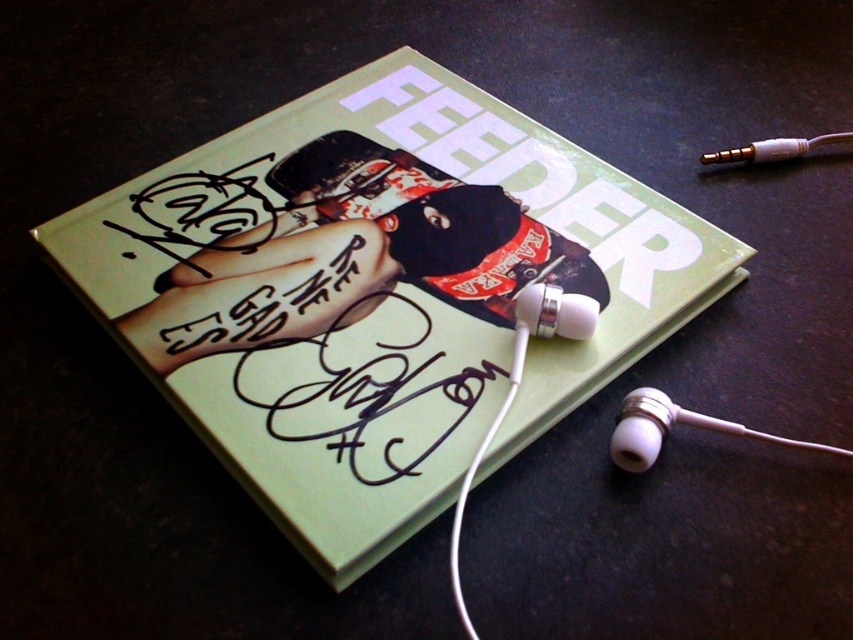
Is green matte book at center further to the viewer compared to white plastic earbud at bottom right?

No, green matte book at center is in front of white plastic earbud at bottom right.

Based on the photo, between green matte book at center and white plastic earbud at bottom right, which one is positioned higher?

green matte book at center is higher up.

Between point (517, 125) and point (688, 419), which one is positioned in front?

Positioned in front is point (688, 419).

The width and height of the screenshot is (853, 640). I want to click on green matte book at center, so click(378, 292).